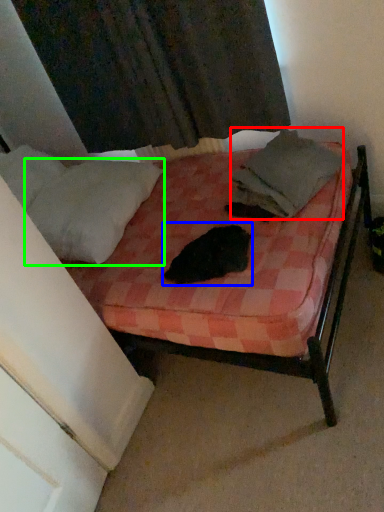
Question: Considering the real-world distances, which object is farthest from blanket (highlighted by a red box)? animal (highlighted by a blue box) or pillow (highlighted by a green box)?

Choices:
 (A) animal
 (B) pillow

Answer: (B)